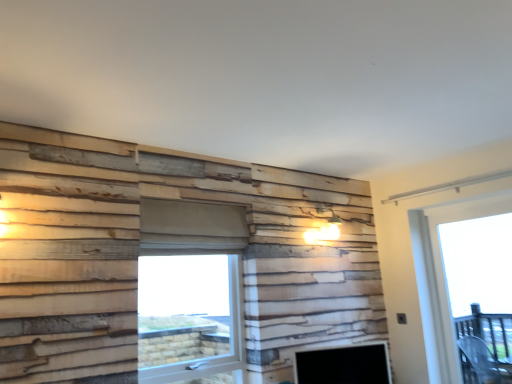
This screenshot has height=384, width=512. What do you see at coordinates (344, 365) in the screenshot?
I see `matte black fireplace at lower center` at bounding box center [344, 365].

Find the location of a particular element. Image resolution: width=512 pixels, height=384 pixels. transparent glass door at right is located at coordinates (444, 280).

In terms of width, does transparent plastic window screen at center look wider or thinner when compared to transparent glass door at right?

transparent plastic window screen at center is wider than transparent glass door at right.

Which object is positioned more to the right, transparent plastic window screen at center or transparent glass door at right?

transparent glass door at right.

In terms of size, does transparent plastic window screen at center appear bigger or smaller than transparent glass door at right?

In the image, transparent plastic window screen at center appears to be larger than transparent glass door at right.

In the image, there is a transparent glass door at right. Where is `window screen below it (from a real-world perspective)`? This screenshot has width=512, height=384. window screen below it (from a real-world perspective) is located at coordinates (183, 308).

From the image's perspective, who appears lower, transparent glass door at right or matte black fireplace at lower center?

matte black fireplace at lower center.

Is transparent glass door at right far from matte black fireplace at lower center?

That's not correct — transparent glass door at right is a little close to matte black fireplace at lower center.

Which is correct: transparent glass door at right is inside matte black fireplace at lower center, or outside of it?

transparent glass door at right is located beyond the bounds of matte black fireplace at lower center.

From the image's perspective, between matte black fireplace at lower center and transparent glass door at right, who is located below?

From the image's view, matte black fireplace at lower center is below.

Is matte black fireplace at lower center turned away from transparent glass door at right?

No.

Which of these two, matte black fireplace at lower center or transparent glass door at right, is bigger?

Bigger between the two is transparent glass door at right.

Would you consider matte black fireplace at lower center to be distant from transparent glass door at right?

No, matte black fireplace at lower center is not far from transparent glass door at right.

Where is `window screen on the left of matte black fireplace at lower center`? The width and height of the screenshot is (512, 384). window screen on the left of matte black fireplace at lower center is located at coordinates (183, 308).

Is transparent plastic window screen at center at the back of matte black fireplace at lower center?

No, matte black fireplace at lower center is not facing away from transparent plastic window screen at center.

From the image's perspective, which is below, matte black fireplace at lower center or transparent plastic window screen at center?

From the image's view, matte black fireplace at lower center is below.

Considering the positions of point (343, 366) and point (167, 303), is point (343, 366) closer or farther from the camera than point (167, 303)?

Point (343, 366) appears to be farther away from the viewer than point (167, 303).

From a real-world perspective, between transparent glass door at right and transparent plastic window screen at center, who is vertically lower?

transparent plastic window screen at center.

Is transparent glass door at right thinner than transparent plastic window screen at center?

Indeed, transparent glass door at right has a lesser width compared to transparent plastic window screen at center.

Would you say transparent glass door at right is a long distance from transparent plastic window screen at center?

Absolutely, transparent glass door at right is distant from transparent plastic window screen at center.

From the image's perspective, which is above, transparent glass door at right or transparent plastic window screen at center?

transparent glass door at right, from the image's perspective.

Which object is thinner, transparent plastic window screen at center or matte black fireplace at lower center?

matte black fireplace at lower center is thinner.

Is transparent plastic window screen at center at the right side of matte black fireplace at lower center?

In fact, transparent plastic window screen at center is to the left of matte black fireplace at lower center.

What's the angular difference between transparent plastic window screen at center and matte black fireplace at lower center's facing directions?

21.5 degrees.

From a real-world perspective, which is physically below, transparent plastic window screen at center or matte black fireplace at lower center?

matte black fireplace at lower center.

The width and height of the screenshot is (512, 384). I want to click on window screen that appears below the transparent glass door at right (from a real-world perspective), so click(183, 308).

Identify the location of fireplace in front of the transparent glass door at right. point(344,365).

From the image, which object appears to be farther from matte black fireplace at lower center, transparent plastic window screen at center or transparent glass door at right?

transparent glass door at right lies further to matte black fireplace at lower center than the other object.

When comparing their distances from matte black fireplace at lower center, does transparent glass door at right or transparent plastic window screen at center seem closer?

Among the two, transparent plastic window screen at center is located nearer to matte black fireplace at lower center.

Looking at the image, which one is located further to transparent plastic window screen at center, matte black fireplace at lower center or transparent glass door at right?

Among the two, transparent glass door at right is located further to transparent plastic window screen at center.

Estimate the real-world distances between objects in this image. Which object is further from transparent glass door at right, matte black fireplace at lower center or transparent plastic window screen at center?

Among the two, transparent plastic window screen at center is located further to transparent glass door at right.

Based on their spatial positions, is transparent plastic window screen at center or matte black fireplace at lower center further from transparent glass door at right?

transparent plastic window screen at center lies further to transparent glass door at right than the other object.

From the picture: Looking at the image, which one is located closer to transparent plastic window screen at center, transparent glass door at right or matte black fireplace at lower center?

Based on the image, matte black fireplace at lower center appears to be nearer to transparent plastic window screen at center.

You are a GUI agent. You are given a task and a screenshot of the screen. Output one action in this format:
    pyautogui.click(x=<x>, y=<y>)
    Task: Click on the fireplace situated between transparent plastic window screen at center and transparent glass door at right from left to right
    This screenshot has height=384, width=512.
    Given the screenshot: What is the action you would take?
    pyautogui.click(x=344, y=365)